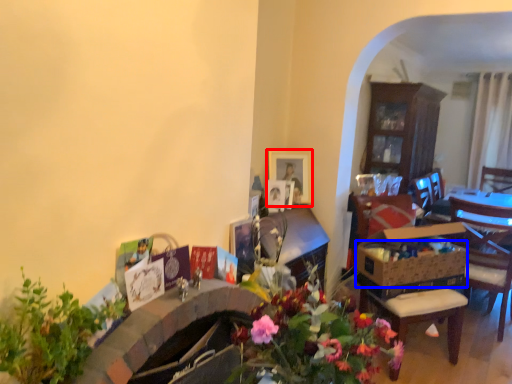
Question: Which object is closer to the camera taking this photo, picture frame (highlighted by a red box) or flower basket (highlighted by a blue box)?

Choices:
 (A) picture frame
 (B) flower basket

Answer: (B)